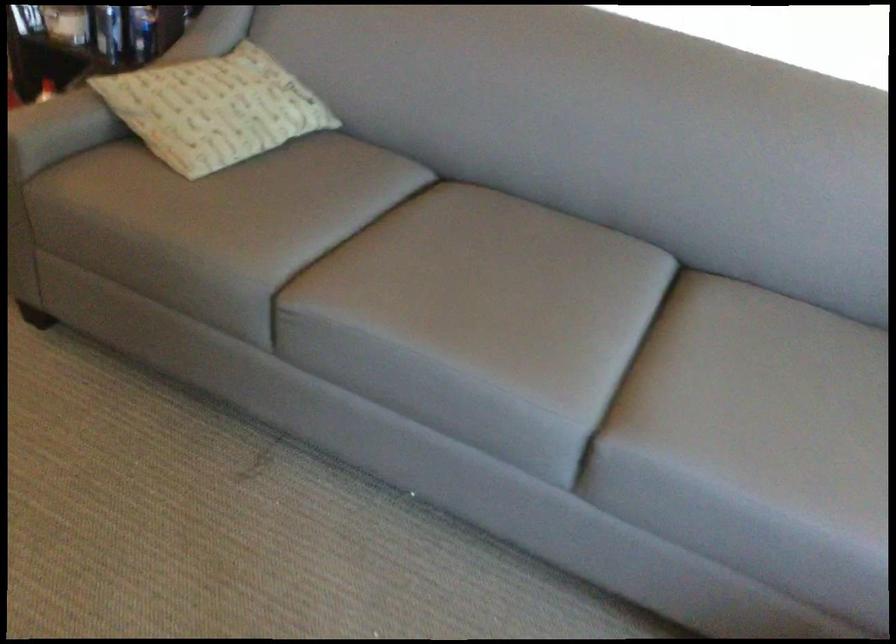
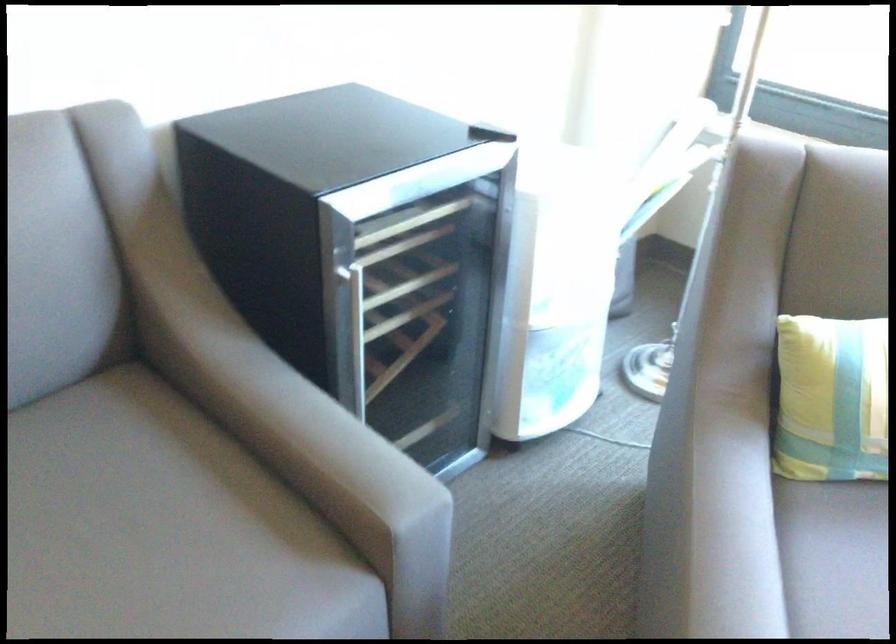
In the second image, find the point that corresponds to [702,354] in the first image.

(83, 529)